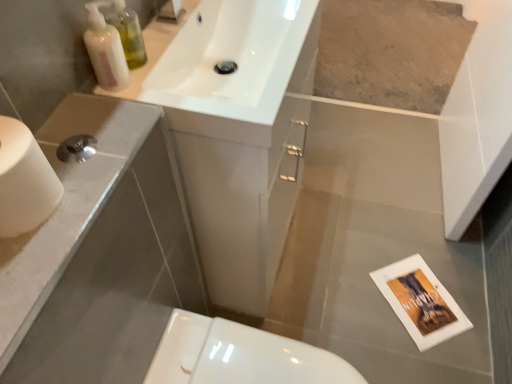
Question: Is white glossy sink at upper center taller than translucent plastic bottles at upper left?

Choices:
 (A) no
 (B) yes

Answer: (B)

Question: Considering the relative sizes of white glossy sink at upper center and translucent plastic bottles at upper left in the image provided, is white glossy sink at upper center smaller than translucent plastic bottles at upper left?

Choices:
 (A) yes
 (B) no

Answer: (B)

Question: Is there a large distance between white glossy sink at upper center and translucent plastic bottles at upper left?

Choices:
 (A) no
 (B) yes

Answer: (A)

Question: From the image's perspective, is white glossy sink at upper center over translucent plastic bottles at upper left?

Choices:
 (A) yes
 (B) no

Answer: (A)

Question: Can we say white glossy sink at upper center lies outside translucent plastic bottles at upper left?

Choices:
 (A) no
 (B) yes

Answer: (B)

Question: Can you see white glossy sink at upper center touching translucent plastic bottles at upper left?

Choices:
 (A) no
 (B) yes

Answer: (A)

Question: Is white glossy sink at upper center positioned far away from white matte toilet paper at left?

Choices:
 (A) yes
 (B) no

Answer: (B)

Question: Is white glossy sink at upper center smaller than white matte toilet paper at left?

Choices:
 (A) yes
 (B) no

Answer: (B)

Question: Can you confirm if white glossy sink at upper center is positioned to the right of white matte toilet paper at left?

Choices:
 (A) yes
 (B) no

Answer: (A)

Question: Is white glossy sink at upper center further to the viewer compared to white matte toilet paper at left?

Choices:
 (A) yes
 (B) no

Answer: (A)

Question: Considering the relative sizes of white glossy sink at upper center and white matte toilet paper at left in the image provided, is white glossy sink at upper center wider than white matte toilet paper at left?

Choices:
 (A) yes
 (B) no

Answer: (A)

Question: Is white glossy sink at upper center facing away from white matte toilet paper at left?

Choices:
 (A) no
 (B) yes

Answer: (A)

Question: Is white glossy toilet at lower center in front of white glossy sink at upper center?

Choices:
 (A) no
 (B) yes

Answer: (A)